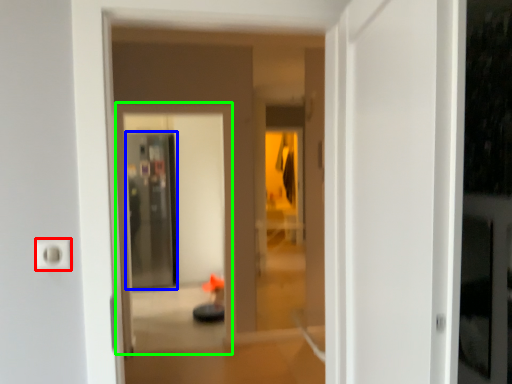
Question: Based on their relative distances, which object is nearer to electric outlet (highlighted by a red box)? Choose from screen door (highlighted by a blue box) and screen door (highlighted by a green box).

Choices:
 (A) screen door
 (B) screen door

Answer: (B)